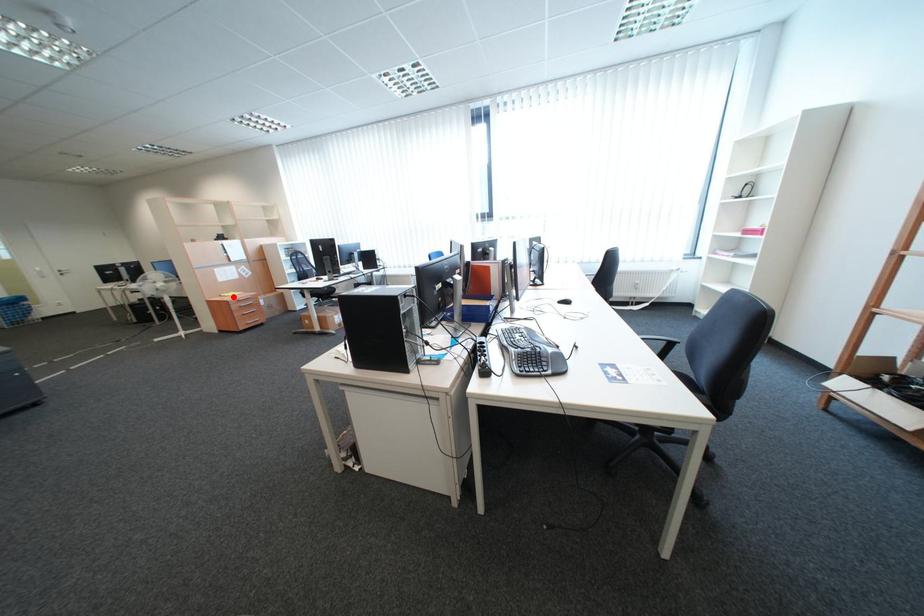
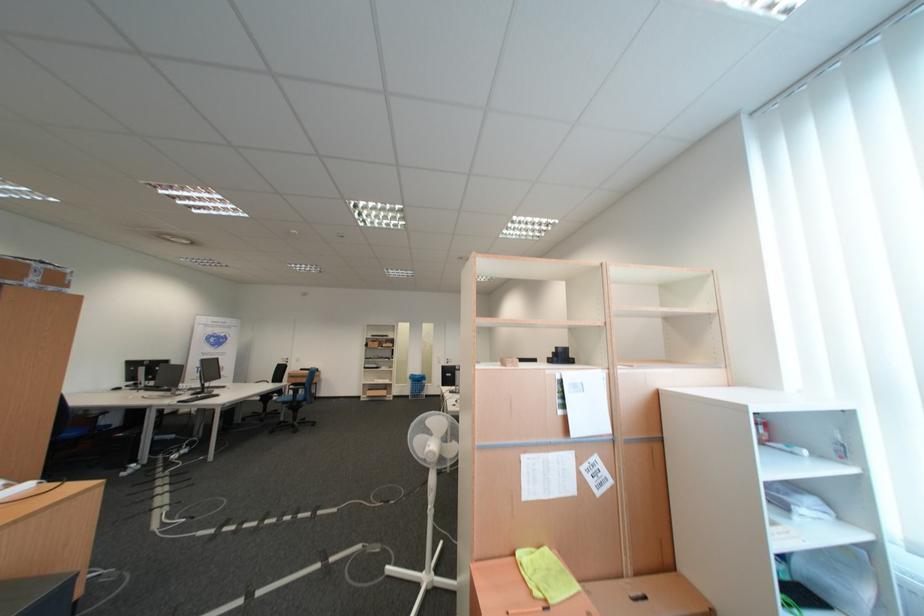
Question: I am providing you with two images of the same scene from different viewpoints. Image1 has a red point marked. In image2, the corresponding 3D location appears at what relative position? Reply with the corresponding letter.

Choices:
 (A) Closer
 (B) Farther

Answer: (B)